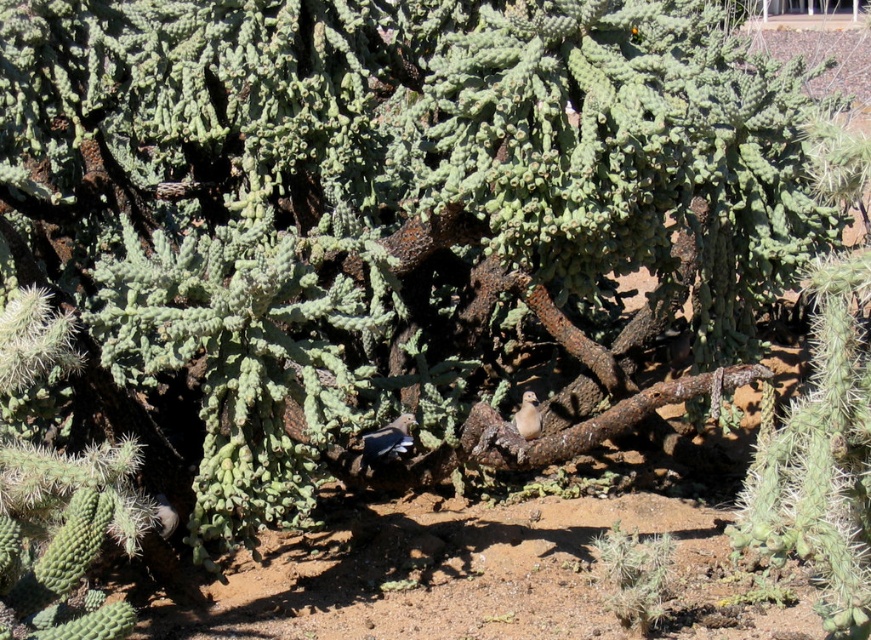
You are a bird watcher trying to identify the species of the light brown feathered bird at center. You notice a rusty metal branch at center nearby. Which object is wider?

The rusty metal branch at center is wider than the light brown feathered bird at center.

You are a birdwatcher observing the desert scene. You notice the rusty metal branch at center and the light brown feathered bird at center. Which object is positioned to the right of the other?

The rusty metal branch at center is to the right of the light brown feathered bird at center, so the rusty metal branch at center is positioned to the right of the light brown feathered bird at center.